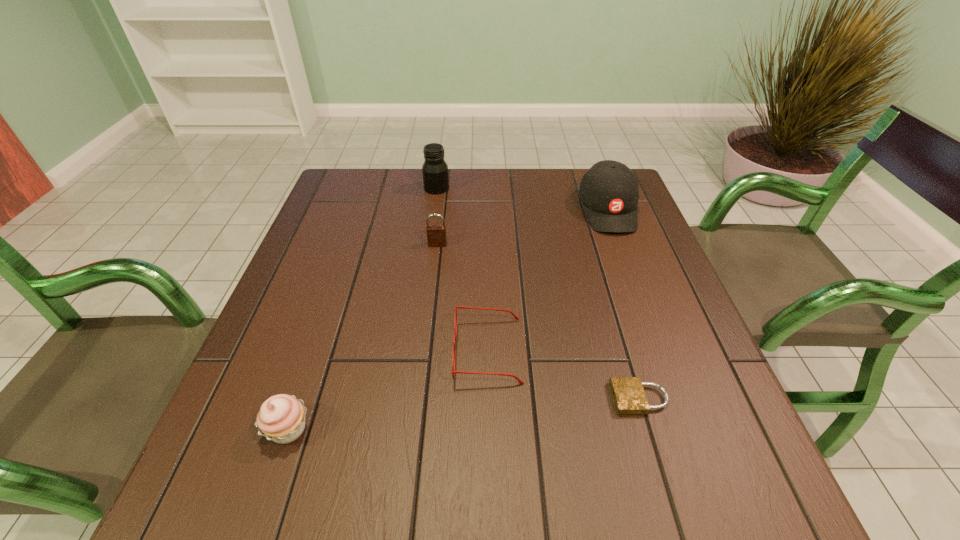
Locate an element on the screen. The height and width of the screenshot is (540, 960). unoccupied position between the baseball cap and the left padlock is located at coordinates (522, 227).

Select which object is the closest to the leftmost object. Please provide its 2D coordinates. Your answer should be formatted as a tuple, i.e. [(x, y)], where the tuple contains the x and y coordinates of a point satisfying the conditions above.

[(462, 307)]

Image resolution: width=960 pixels, height=540 pixels. What are the coordinates of `object that stands as the closest to the shorter padlock` in the screenshot? It's located at (462, 307).

I want to click on free location that satisfies the following two spatial constraints: 1. with a logo on the front of the baseball cap; 2. on the keyhole side of the shorter padlock, so click(677, 398).

The width and height of the screenshot is (960, 540). In order to click on vacant area that satisfies the following two spatial constraints: 1. with a logo on the front of the baseball cap; 2. on the face of the second shortest object in this screenshot , I will do `click(660, 351)`.